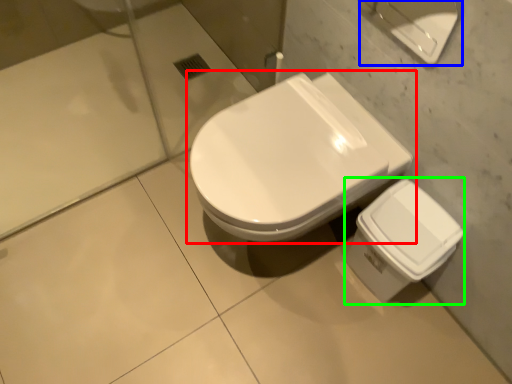
Question: Which object is the farthest from toilet (highlighted by a red box)? Choose among these: porcelain (highlighted by a blue box) or porcelain (highlighted by a green box).

Choices:
 (A) porcelain
 (B) porcelain

Answer: (A)